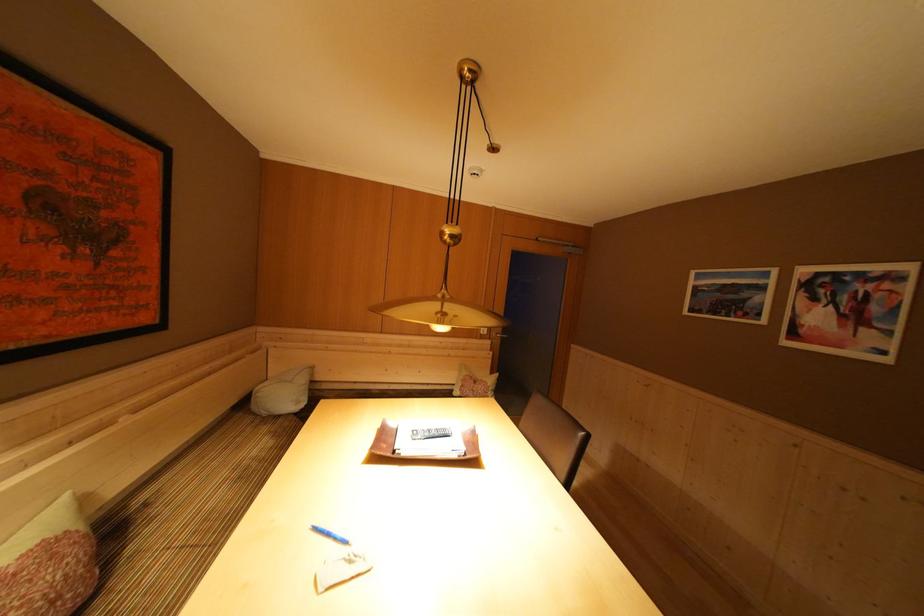
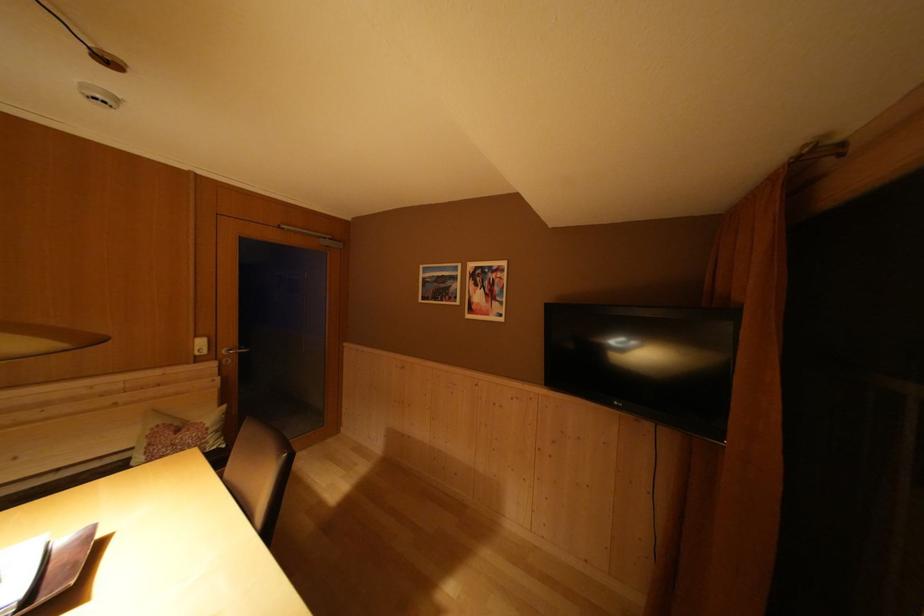
Find the pixel in the second image that matches [435,390] in the first image.

(66, 475)